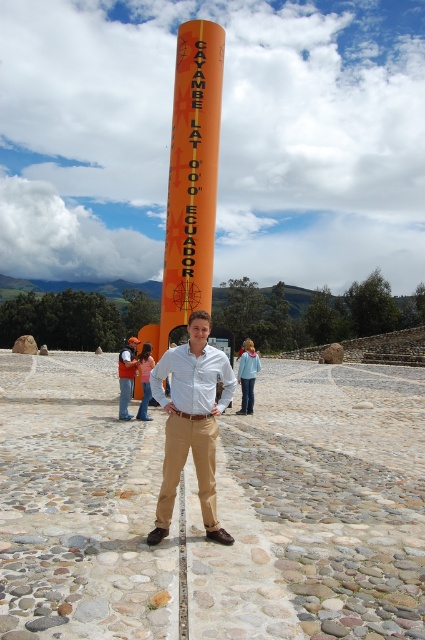
Is matte khaki pants at center below matte white shirt at center?

No.

Who is taller, matte khaki pants at center or matte white shirt at center?

matte white shirt at center

Is point (178, 420) behind point (127, 348)?

No, (178, 420) is in front of (127, 348).

You are a GUI agent. You are given a task and a screenshot of the screen. Output one action in this format:
    pyautogui.click(x=<x>, y=<y>)
    Task: Click on the matte khaki pants at center
    This screenshot has width=425, height=640.
    Given the screenshot: What is the action you would take?
    pyautogui.click(x=192, y=420)

Between orange vinyl pole at center and matte white shirt at center, which one appears on the right side from the viewer's perspective?

orange vinyl pole at center is more to the right.

Does orange vinyl pole at center appear on the right side of matte white shirt at center?

Indeed, orange vinyl pole at center is positioned on the right side of matte white shirt at center.

Locate an element on the screen. orange vinyl pole at center is located at coordinates (x=192, y=144).

Is matte khaki pants at center positioned behind orange vinyl pole at center?

No, matte khaki pants at center is in front of orange vinyl pole at center.

Between matte khaki pants at center and orange vinyl pole at center, which one is positioned lower?

matte khaki pants at center is below.

Identify the location of matte khaki pants at center. (192, 420).